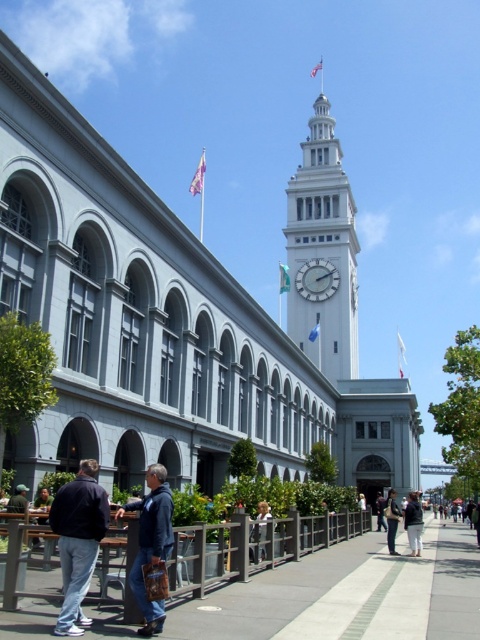
Is white stone clock tower at upper center further to camera compared to dark blue jacket at lower left?

Yes, it is.

Is white stone clock tower at upper center positioned in front of dark blue jacket at lower left?

No.

Is point (333, 122) closer to camera compared to point (85, 570)?

No, (333, 122) is behind (85, 570).

The image size is (480, 640). In order to click on white stone clock tower at upper center in this screenshot , I will do (323, 250).

Can you confirm if concrete sidewalk at center is smaller than dark blue jeans at center?

No.

Does concrete sidewalk at center appear on the left side of dark blue jeans at center?

Indeed, concrete sidewalk at center is positioned on the left side of dark blue jeans at center.

What do you see at coordinates (348, 595) in the screenshot? The width and height of the screenshot is (480, 640). I see `concrete sidewalk at center` at bounding box center [348, 595].

The image size is (480, 640). Identify the location of concrete sidewalk at center. (348, 595).

Is denim jacket at lower center wider than white glossy clock at upper center?

No, denim jacket at lower center is not wider than white glossy clock at upper center.

Between denim jacket at lower center and white glossy clock at upper center, which one is positioned higher?

white glossy clock at upper center is higher up.

Measure the distance between point (152, 621) and camera.

Point (152, 621) and camera are 18.98 meters apart.

Find the location of `denim jacket at lower center`. denim jacket at lower center is located at coordinates (151, 541).